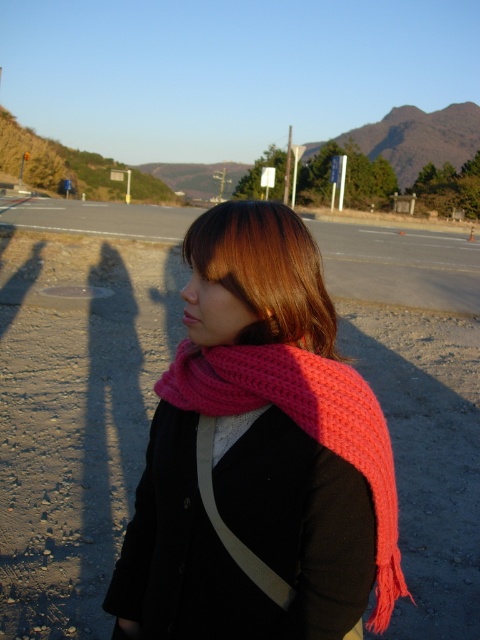
Is pink knitted scarf at center further to camera compared to brownwoollyhair at center?

No, it is not.

Can you confirm if pink knitted scarf at center is positioned to the left of brownwoollyhair at center?

In fact, pink knitted scarf at center is to the right of brownwoollyhair at center.

Between point (312, 426) and point (229, 216), which one is positioned in front?

Point (312, 426) is in front.

Image resolution: width=480 pixels, height=640 pixels. I want to click on pink knitted scarf at center, so click(302, 422).